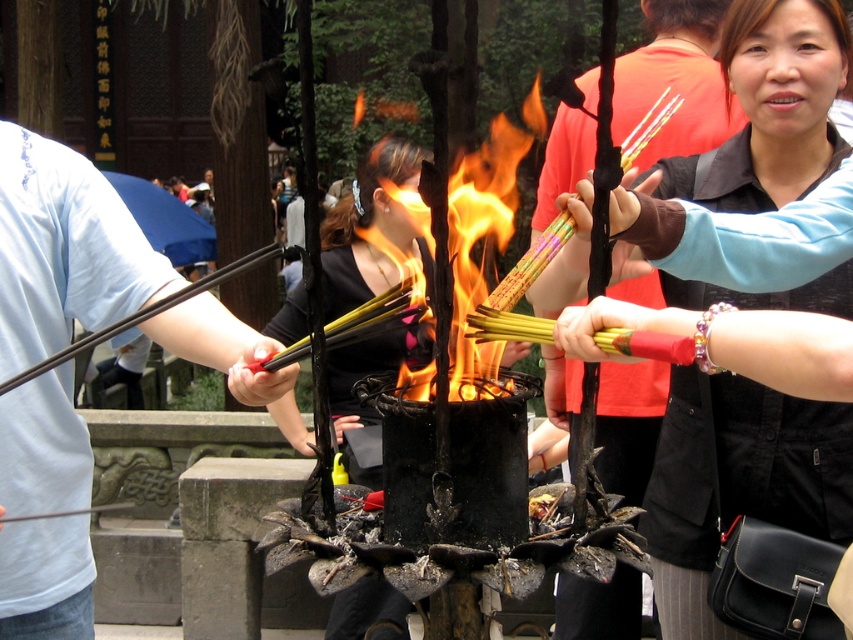
Is matte black incense sticks at center smaller than flameflame" at "center?

Correct, matte black incense sticks at center occupies less space than flameflame" at "center.

Which is above, matte black incense sticks at center or flameflame" at "center?

flameflame" at "center is above.

Is point (669, 296) in front of point (537, 72)?

Yes, it is.

Identify the location of matte black incense sticks at center. This screenshot has height=640, width=853. (773, 106).